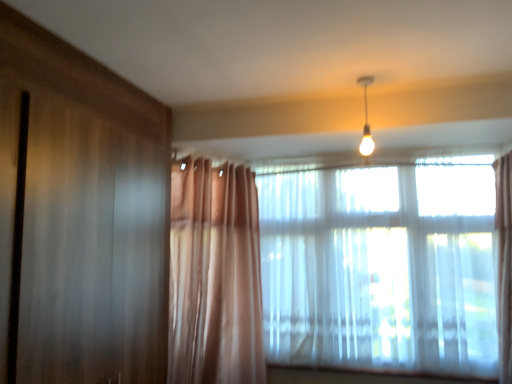
How much space does translucent fabric window at center, the 1th window when ordered from left to right, occupy horizontally?

3.90 inches.

The width and height of the screenshot is (512, 384). What do you see at coordinates (456, 265) in the screenshot? I see `translucent fabric window at upper right, acting as the second window starting from the left` at bounding box center [456, 265].

This screenshot has width=512, height=384. Describe the element at coordinates (366, 120) in the screenshot. I see `matte white bulb at upper center` at that location.

Locate an element on the screen. This screenshot has width=512, height=384. translucent fabric window at center, the 1th window when ordered from left to right is located at coordinates (381, 267).

Does translucent fabric window at upper right, acting as the second window starting from the left, have a smaller size compared to matte white bulb at upper center?

No.

Can matte white bulb at upper center be found inside translucent fabric window at upper right, placed as the first window when sorted from right to left?

No, translucent fabric window at upper right, placed as the first window when sorted from right to left, does not contain matte white bulb at upper center.

In the scene shown: From the image's perspective, relative to matte white bulb at upper center, is translucent fabric window at upper right, placed as the first window when sorted from right to left, above or below?

translucent fabric window at upper right, placed as the first window when sorted from right to left, is situated lower than matte white bulb at upper center in the image.

Does translucent fabric window at upper right, acting as the second window starting from the left, turn towards matte white bulb at upper center?

Yes, translucent fabric window at upper right, acting as the second window starting from the left, is facing matte white bulb at upper center.

In the scene shown: Considering the sizes of objects translucent fabric window at upper right, acting as the second window starting from the left, and translucent fabric window at center, the 1th window when ordered from left to right, in the image provided, who is bigger, translucent fabric window at upper right, acting as the second window starting from the left, or translucent fabric window at center, the 1th window when ordered from left to right,?

translucent fabric window at upper right, acting as the second window starting from the left, is bigger.

Is translucent fabric window at upper right, placed as the first window when sorted from right to left, positioned beyond the bounds of translucent fabric window at center, the 1th window when ordered from left to right?

translucent fabric window at upper right, placed as the first window when sorted from right to left, lies outside translucent fabric window at center, the 1th window when ordered from left to right,'s area.

Is translucent fabric window at upper right, placed as the first window when sorted from right to left, closer to the viewer compared to translucent fabric window at center, the 1th window when ordered from left to right?

Yes.

Does translucent fabric window at upper right, acting as the second window starting from the left, have a lesser height compared to translucent fabric window at center, the 1th window when ordered from left to right?

Incorrect, the height of translucent fabric window at upper right, acting as the second window starting from the left, does not fall short of that of translucent fabric window at center, the 1th window when ordered from left to right.

Could you tell me if translucent fabric window at center, the 1th window when ordered from left to right, is turned towards translucent fabric window at upper right, acting as the second window starting from the left?

Yes.

Based on the photo, is translucent fabric window at center, acting as the 2th window starting from the right, next to translucent fabric window at upper right, placed as the first window when sorted from right to left, and touching it?

No, translucent fabric window at center, acting as the 2th window starting from the right, is not beside translucent fabric window at upper right, placed as the first window when sorted from right to left.

Considering the positions of point (429, 270) and point (485, 299), is point (429, 270) closer or farther from the camera than point (485, 299)?

Point (429, 270) is farther from the camera than point (485, 299).

In terms of size, does translucent fabric window at center, the 1th window when ordered from left to right, appear bigger or smaller than translucent fabric window at upper right, acting as the second window starting from the left?

Considering their sizes, translucent fabric window at center, the 1th window when ordered from left to right, takes up less space than translucent fabric window at upper right, acting as the second window starting from the left.

From the image's perspective, is translucent fabric window at center, the 1th window when ordered from left to right, under matte white bulb at upper center?

Indeed, from the image's perspective, translucent fabric window at center, the 1th window when ordered from left to right, is shown beneath matte white bulb at upper center.

Considering the points (476, 356) and (360, 151), which point is behind, point (476, 356) or point (360, 151)?

The point (360, 151) is behind.

Considering their positions, is translucent fabric window at center, acting as the 2th window starting from the right, located in front of or behind matte white bulb at upper center?

Visually, translucent fabric window at center, acting as the 2th window starting from the right, is located behind matte white bulb at upper center.

Could you tell me if translucent fabric window at center, the 1th window when ordered from left to right, is turned towards matte white bulb at upper center?

Yes.

Visually, is matte white bulb at upper center positioned to the left or to the right of translucent fabric window at center, the 1th window when ordered from left to right?

In the image, matte white bulb at upper center appears on the left side of translucent fabric window at center, the 1th window when ordered from left to right.

The image size is (512, 384). What are the coordinates of `window that is the 2nd one when counting downward from the matte white bulb at upper center (from the image's perspective)` in the screenshot? It's located at (381, 267).

Is matte white bulb at upper center at the right side of translucent fabric window at upper right, acting as the second window starting from the left?

Incorrect, matte white bulb at upper center is not on the right side of translucent fabric window at upper right, acting as the second window starting from the left.

Does matte white bulb at upper center have a greater height compared to translucent fabric window at upper right, acting as the second window starting from the left?

No, matte white bulb at upper center is not taller than translucent fabric window at upper right, acting as the second window starting from the left.

Is matte white bulb at upper center facing away from translucent fabric window at upper right, acting as the second window starting from the left?

No, matte white bulb at upper center's orientation is not away from translucent fabric window at upper right, acting as the second window starting from the left.

Identify the location of window in front of the matte white bulb at upper center. This screenshot has width=512, height=384. (456, 265).

This screenshot has height=384, width=512. I want to click on window to the right of translucent fabric window at center, the 1th window when ordered from left to right, so click(x=456, y=265).

Which object lies further to the anchor point matte white bulb at upper center, translucent fabric window at upper right, placed as the first window when sorted from right to left, or translucent fabric window at center, acting as the 2th window starting from the right?

Based on the image, translucent fabric window at upper right, placed as the first window when sorted from right to left, appears to be further to matte white bulb at upper center.

Based on the photo, from the image, which object appears to be nearer to translucent fabric window at center, the 1th window when ordered from left to right, translucent fabric window at upper right, placed as the first window when sorted from right to left, or matte white bulb at upper center?

translucent fabric window at upper right, placed as the first window when sorted from right to left, lies closer to translucent fabric window at center, the 1th window when ordered from left to right, than the other object.

Based on their spatial positions, is matte white bulb at upper center or translucent fabric window at center, acting as the 2th window starting from the right, further from translucent fabric window at upper right, acting as the second window starting from the left?

matte white bulb at upper center.

Looking at the image, which one is located further to matte white bulb at upper center, translucent fabric window at center, the 1th window when ordered from left to right, or translucent fabric window at upper right, placed as the first window when sorted from right to left?

The object further to matte white bulb at upper center is translucent fabric window at upper right, placed as the first window when sorted from right to left.

When comparing their distances from translucent fabric window at upper right, placed as the first window when sorted from right to left, does translucent fabric window at center, the 1th window when ordered from left to right, or matte white bulb at upper center seem further?

matte white bulb at upper center is positioned further to the anchor translucent fabric window at upper right, placed as the first window when sorted from right to left.

When comparing their distances from translucent fabric window at center, acting as the 2th window starting from the right, does matte white bulb at upper center or translucent fabric window at upper right, acting as the second window starting from the left, seem further?

Based on the image, matte white bulb at upper center appears to be further to translucent fabric window at center, acting as the 2th window starting from the right.

The image size is (512, 384). Find the location of `window between matte white bulb at upper center and translucent fabric window at center, the 1th window when ordered from left to right, in the vertical direction`. window between matte white bulb at upper center and translucent fabric window at center, the 1th window when ordered from left to right, in the vertical direction is located at coordinates (456, 265).